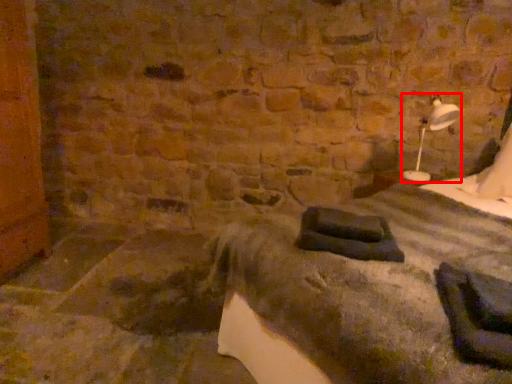
Question: From the image's perspective, considering the relative positions of bedside lamp (annotated by the red box) and bed in the image provided, where is bedside lamp (annotated by the red box) located with respect to the staircase?

Choices:
 (A) below
 (B) above

Answer: (B)